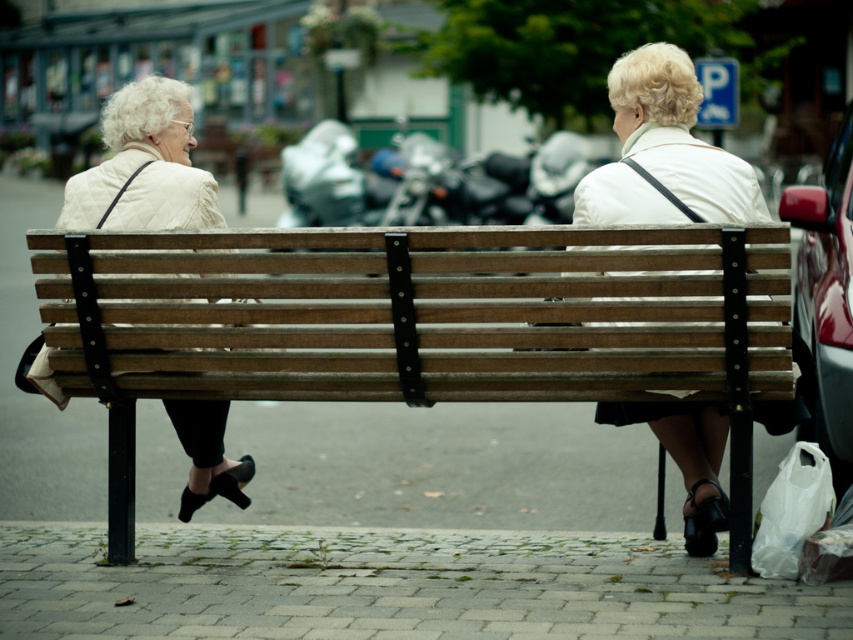
Question: Can you confirm if white quilted jacket at left is positioned above metallic red car at right?

Choices:
 (A) yes
 (B) no

Answer: (A)

Question: Which of the following is the farthest from the observer?

Choices:
 (A) white fabric jacket at center
 (B) white quilted jacket at left
 (C) metallic red car at right

Answer: (C)

Question: Which of the following is the closest to the observer?

Choices:
 (A) white quilted jacket at left
 (B) metallic red car at right
 (C) wooden bench at center
 (D) white fabric jacket at center

Answer: (C)

Question: Which object is the farthest from the white fabric jacket at center?

Choices:
 (A) white quilted jacket at left
 (B) metallic red car at right
 (C) wooden bench at center

Answer: (B)

Question: Is white quilted jacket at left positioned behind metallic red car at right?

Choices:
 (A) yes
 (B) no

Answer: (B)

Question: Is wooden bench at center closer to camera compared to metallic red car at right?

Choices:
 (A) yes
 (B) no

Answer: (A)